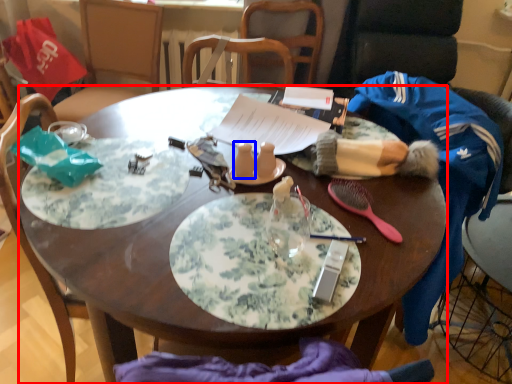
Question: Which of the following is the closest to the observer, desk (highlighted by a red box) or tableware (highlighted by a blue box)?

Choices:
 (A) desk
 (B) tableware

Answer: (A)